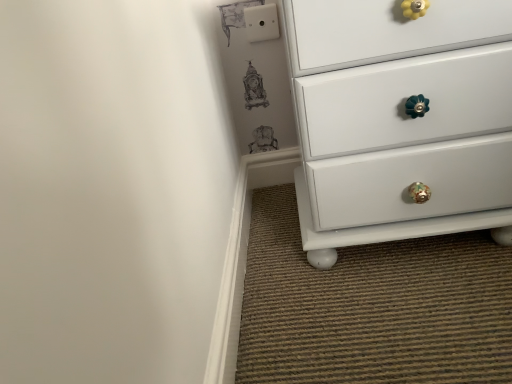
Find the location of a particular element. white glossy chest of drawers at lower right is located at coordinates (400, 120).

The image size is (512, 384). What do you see at coordinates (400, 120) in the screenshot? I see `white glossy chest of drawers at lower right` at bounding box center [400, 120].

In order to click on white glossy chest of drawers at lower right in this screenshot , I will do `click(400, 120)`.